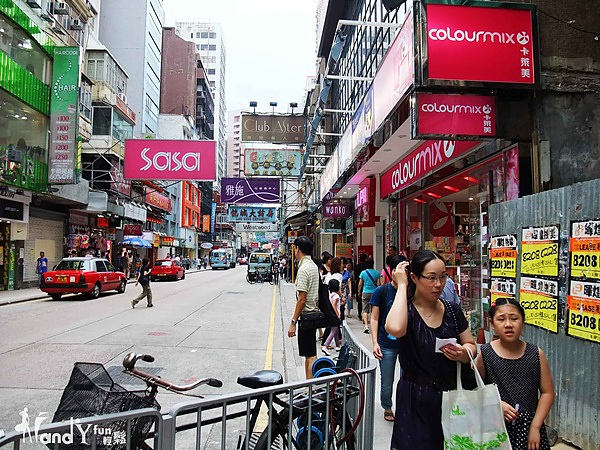
You are a GUI agent. You are given a task and a screenshot of the screen. Output one action in this format:
    pyautogui.click(x=<x>, y=<y>)
    Task: Click on the basket
    The height and width of the screenshot is (450, 600).
    Given the screenshot: What is the action you would take?
    pyautogui.click(x=99, y=384)